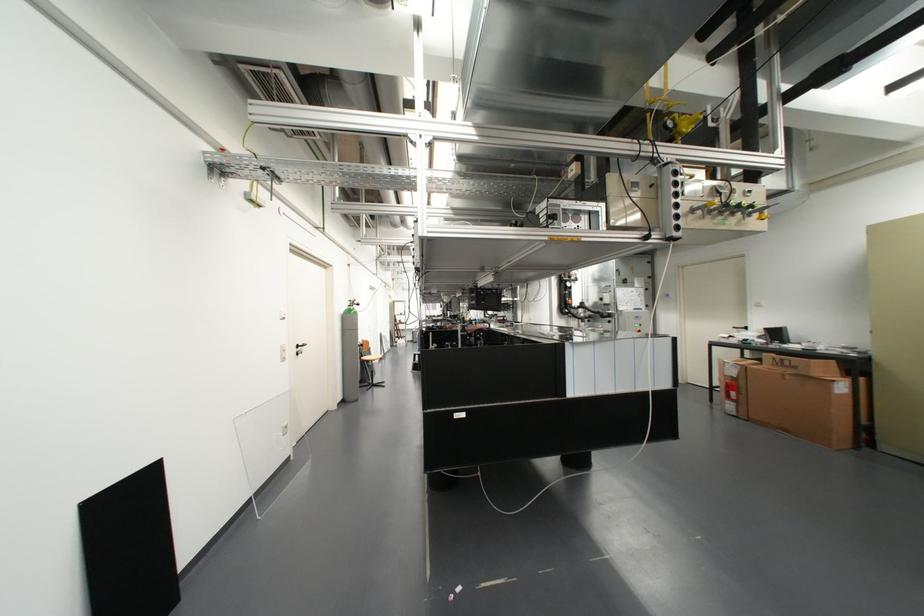
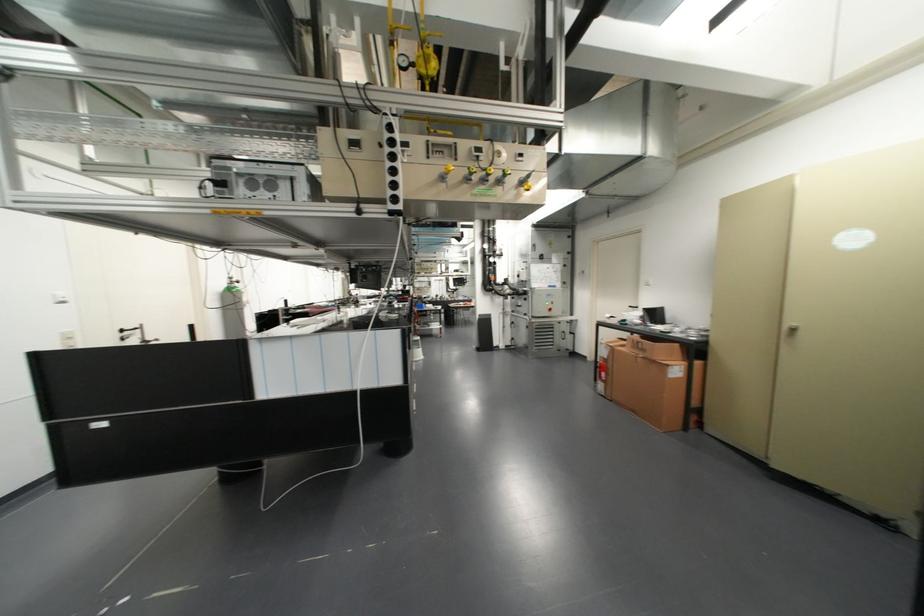
Find the pixel in the second image that matches point (733, 392) in the first image.

(602, 374)